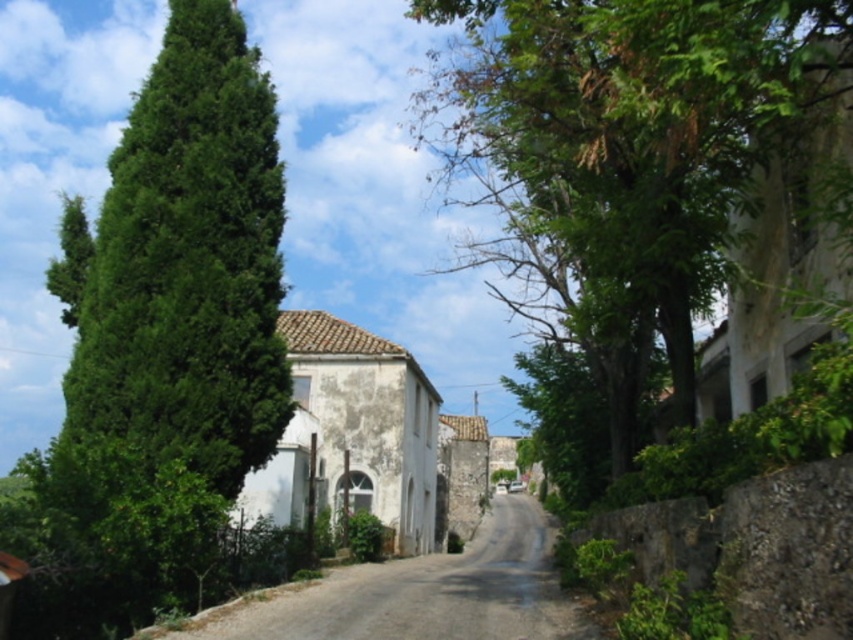
Question: Among these objects, which one is farthest from the camera?

Choices:
 (A) green leafy tree at center
 (B) green leafy tree at left

Answer: (B)

Question: Estimate the real-world distances between objects in this image. Which object is farther from the smooth stone wall at left?

Choices:
 (A) green leafy tree at center
 (B) green leafy tree at left

Answer: (A)

Question: Does green leafy tree at left appear over smooth stone wall at left?

Choices:
 (A) no
 (B) yes

Answer: (B)

Question: Which point is farther to the camera?

Choices:
 (A) (553, 84)
 (B) (421, 561)

Answer: (B)

Question: Is green leafy tree at center smaller than smooth stone wall at left?

Choices:
 (A) no
 (B) yes

Answer: (A)

Question: Can you confirm if green leafy tree at center is bigger than smooth stone wall at left?

Choices:
 (A) no
 (B) yes

Answer: (B)